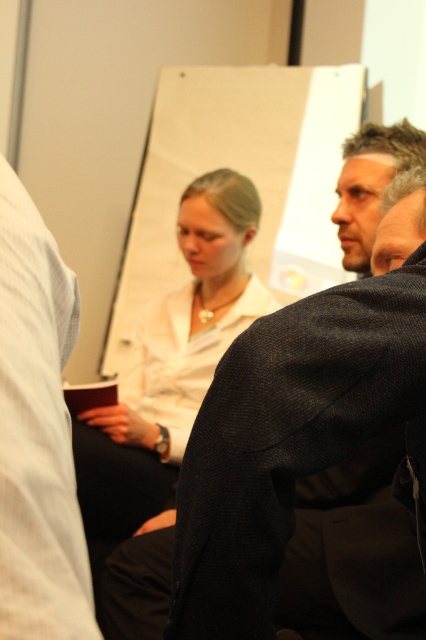
Who is higher up, white matte shirt at center or dark gray suit at upper right?

dark gray suit at upper right

Between white matte shirt at center and dark gray suit at upper right, which one appears on the right side from the viewer's perspective?

From the viewer's perspective, dark gray suit at upper right appears more on the right side.

What do you see at coordinates (170, 365) in the screenshot? I see `white matte shirt at center` at bounding box center [170, 365].

The width and height of the screenshot is (426, 640). Identify the location of white matte shirt at center. (170, 365).

Between dark gray suit at center and white matte shirt at center, which one is positioned higher?

Positioned higher is white matte shirt at center.

Between point (233, 520) and point (184, 292), which one is positioned behind?

Positioned behind is point (184, 292).

Identify the location of dark gray suit at center. (299, 426).

Is point (218, 572) positioned after point (0, 230)?

Yes, point (218, 572) is behind point (0, 230).

From the picture: Is dark gray suit at center below white shirt at left?

Correct, dark gray suit at center is located below white shirt at left.

The width and height of the screenshot is (426, 640). Describe the element at coordinates (299, 426) in the screenshot. I see `dark gray suit at center` at that location.

The image size is (426, 640). What are the coordinates of `dark gray suit at center` in the screenshot? It's located at (299, 426).